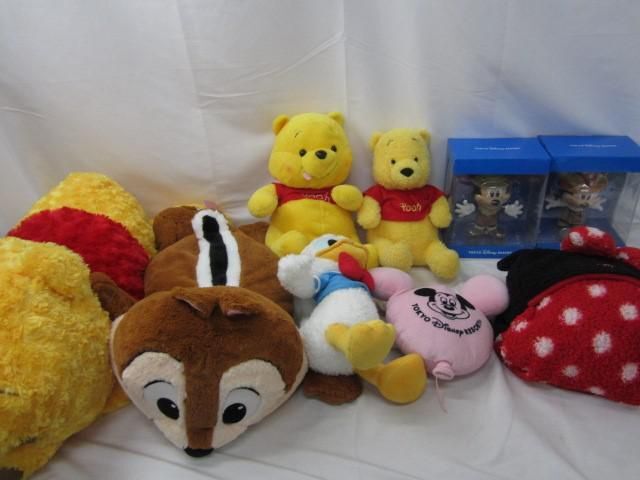
Where is `stuffed animals`? stuffed animals is located at coordinates (58, 348), (208, 342), (344, 296), (428, 312), (584, 310), (403, 191), (303, 207).